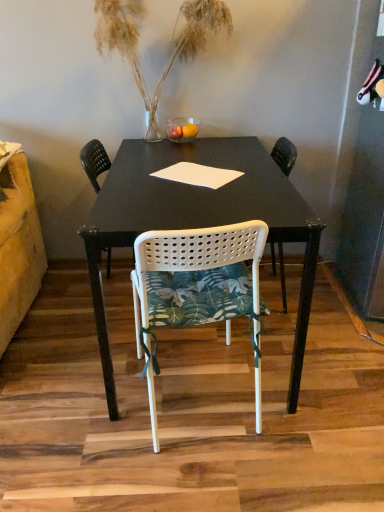
Question: Can you confirm if translucent glass vase at upper center is shorter than white perforated plastic chair at center, arranged as the 1th chair when viewed from the back?

Choices:
 (A) no
 (B) yes

Answer: (B)

Question: Is translucent glass vase at upper center oriented towards white perforated plastic chair at center, the second chair viewed from the front?

Choices:
 (A) no
 (B) yes

Answer: (A)

Question: Does translucent glass vase at upper center appear on the right side of white perforated plastic chair at center, arranged as the 1th chair when viewed from the back?

Choices:
 (A) no
 (B) yes

Answer: (B)

Question: Is translucent glass vase at upper center at the left side of white perforated plastic chair at center, arranged as the 1th chair when viewed from the back?

Choices:
 (A) yes
 (B) no

Answer: (B)

Question: Does translucent glass vase at upper center have a smaller size compared to white perforated plastic chair at center, the second chair viewed from the front?

Choices:
 (A) yes
 (B) no

Answer: (A)

Question: In terms of width, does translucent glass vase at upper center look wider or thinner when compared to white perforated plastic chair at center, the second chair viewed from the front?

Choices:
 (A) wide
 (B) thin

Answer: (B)

Question: Based on their sizes in the image, would you say translucent glass vase at upper center is bigger or smaller than white perforated plastic chair at center, arranged as the 1th chair when viewed from the back?

Choices:
 (A) big
 (B) small

Answer: (B)

Question: Considering the positions of point (135, 36) and point (97, 154), is point (135, 36) closer or farther from the camera than point (97, 154)?

Choices:
 (A) farther
 (B) closer

Answer: (B)

Question: Considering their positions, is translucent glass vase at upper center located in front of or behind white perforated plastic chair at center, the second chair viewed from the front?

Choices:
 (A) behind
 (B) front

Answer: (B)

Question: Considering the positions of translucent glass vase at upper center and white perforated plastic chair at center, positioned as the 1th chair in front-to-back order, in the image, is translucent glass vase at upper center taller or shorter than white perforated plastic chair at center, positioned as the 1th chair in front-to-back order,?

Choices:
 (A) tall
 (B) short

Answer: (B)

Question: Do you think translucent glass vase at upper center is within white perforated plastic chair at center, which is counted as the second chair, starting from the back, or outside of it?

Choices:
 (A) outside
 (B) inside

Answer: (A)

Question: Is translucent glass vase at upper center bigger or smaller than white perforated plastic chair at center, which is counted as the second chair, starting from the back?

Choices:
 (A) big
 (B) small

Answer: (B)

Question: From the image's perspective, is translucent glass vase at upper center located above or below white perforated plastic chair at center, which is counted as the second chair, starting from the back?

Choices:
 (A) below
 (B) above

Answer: (B)

Question: Is white perforated plastic chair at center, arranged as the 1th chair when viewed from the back, bigger or smaller than translucent glass vase at upper center?

Choices:
 (A) big
 (B) small

Answer: (A)

Question: Is point pos(102,164) closer or farther from the camera than point pos(119,10)?

Choices:
 (A) closer
 (B) farther

Answer: (B)